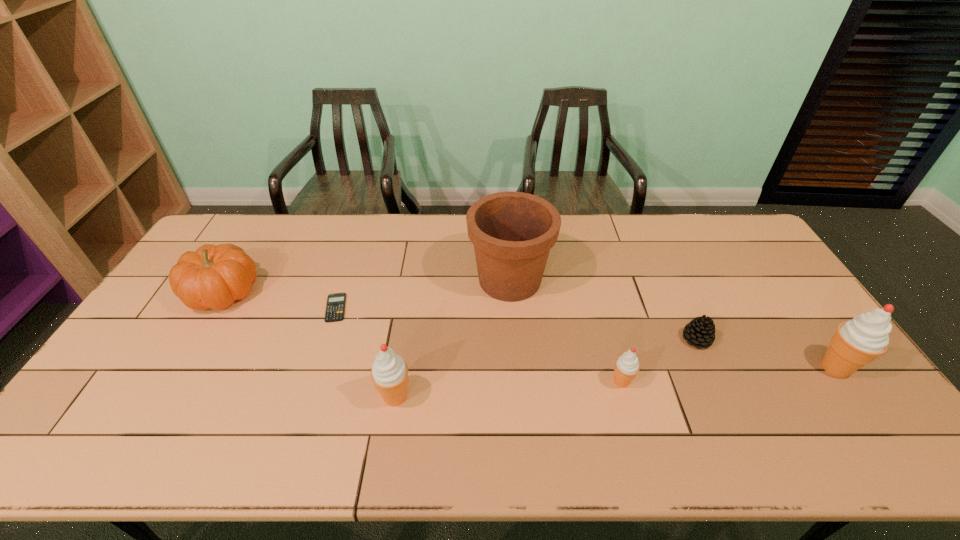
The height and width of the screenshot is (540, 960). I want to click on empty location between the pumpkin and the flowerpot, so click(x=367, y=286).

At what (x,y) coordinates should I click in order to perform the action: click on empty space between the rightmost icecream and the shortest icecream. Please return your answer as a coordinate pair (x, y). The height and width of the screenshot is (540, 960). Looking at the image, I should click on (729, 375).

At what (x,y) coordinates should I click in order to perform the action: click on free area in between the pumpkin and the second shortest object. Please return your answer as a coordinate pair (x, y). This screenshot has height=540, width=960. Looking at the image, I should click on (460, 315).

This screenshot has width=960, height=540. In order to click on free area in between the second tallest icecream and the shortest object in this screenshot , I will do `click(366, 352)`.

Locate an element on the screen. free space between the calculator and the flowerpot is located at coordinates (422, 294).

Where is `vacant space in between the rightmost object and the fourth tallest object`? The height and width of the screenshot is (540, 960). vacant space in between the rightmost object and the fourth tallest object is located at coordinates (529, 330).

Where is `free space between the leftmost icecream and the pumpkin`? free space between the leftmost icecream and the pumpkin is located at coordinates (309, 345).

Identify the location of free space between the fifth shortest object and the pumpkin. This screenshot has height=540, width=960. (309, 345).

The height and width of the screenshot is (540, 960). Find the location of `free space between the third tallest object and the calculator`. free space between the third tallest object and the calculator is located at coordinates (366, 352).

Find the location of a particular element. The image size is (960, 540). vacant region between the rightmost object and the second object from left to right is located at coordinates (586, 338).